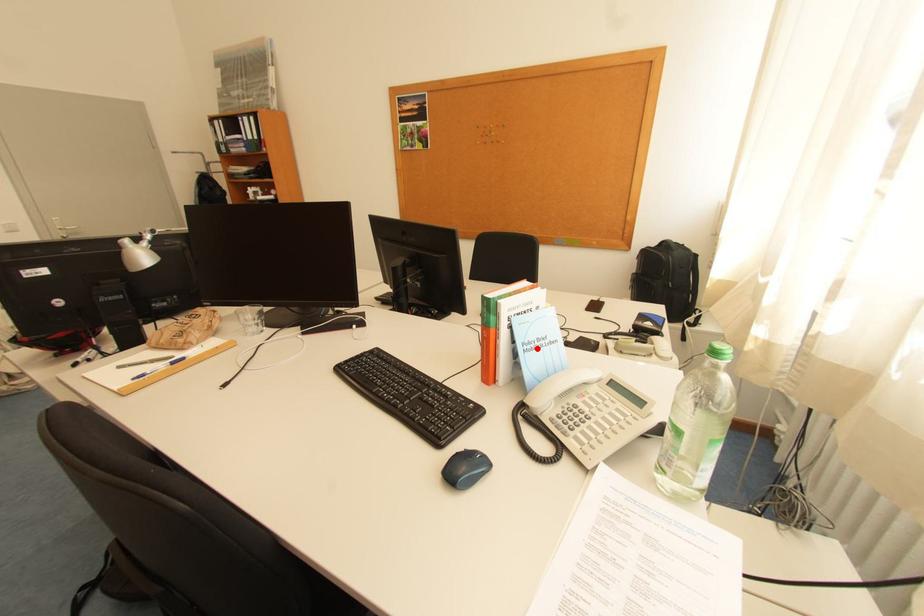
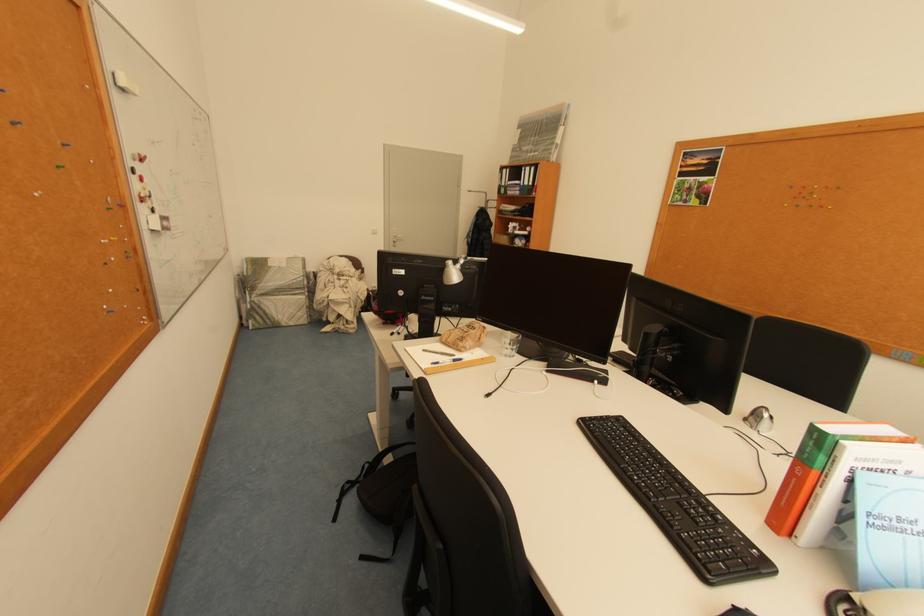
Question: I am providing you with two images of the same scene from different viewpoints. A red point is shown in image1. For the corresponding object point in image2, is it positioned nearer or farther from the camera?

Choices:
 (A) Nearer
 (B) Farther

Answer: (A)